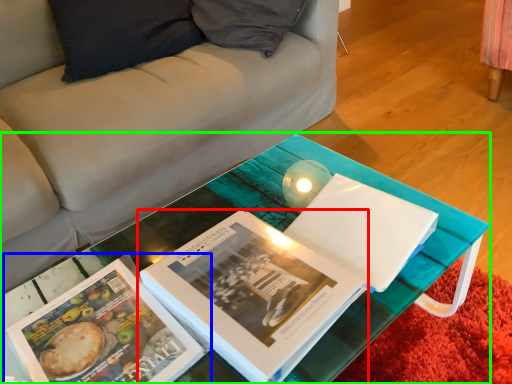
Question: Which object is positioned closest to book (highlighted by a red box)? Select from book (highlighted by a blue box) and table (highlighted by a green box).

Choices:
 (A) book
 (B) table

Answer: (B)